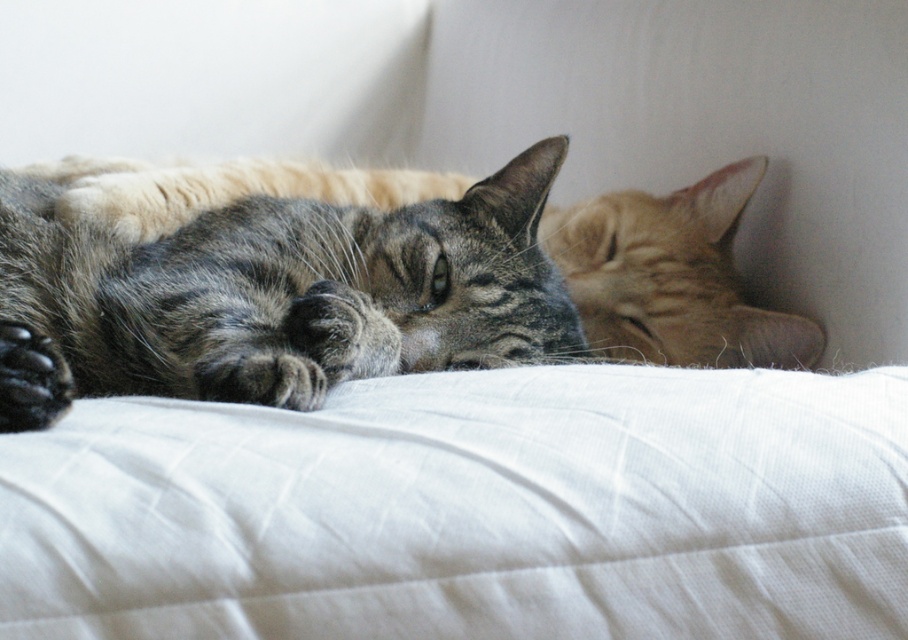
You are trying to find the white quilted pillow at center in the image. Where should you look relative to the black fur paw at lower left?

The white quilted pillow at center is positioned on the right side of black fur paw at lower left, so look to the right of the black fur paw at lower left to find it.

You are a photographer trying to capture a closeup of the white quilted pillow at center and the tabby fur cat at center. Which object should you focus on first to ensure it appears sharp in the photo?

The white quilted pillow at center is closer to the viewer than the tabby fur cat at center, so you should focus on the white quilted pillow at center first to ensure it appears sharp in the photo.

You are trying to place a small toy between the two cats on the white quilted pillow at center. Can you determine if there is enough space between them?

The white quilted pillow at center is located at point [470,509]. However, the description does not provide information about the distance between the two cats, so it is impossible to determine if there is enough space between them.